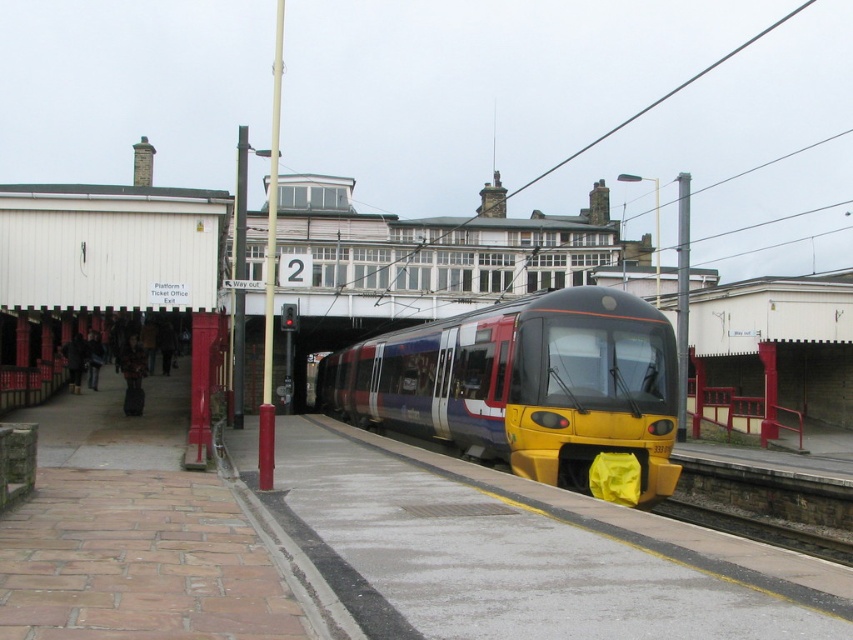
Question: Which point is farther to the camera?

Choices:
 (A) metallic blue train at center
 (B) smooth concrete train track at lower right

Answer: (A)

Question: Is metallic blue train at center above smooth concrete train track at lower right?

Choices:
 (A) no
 (B) yes

Answer: (B)

Question: In this image, where is metallic blue train at center located relative to smooth concrete train track at lower right?

Choices:
 (A) below
 (B) above

Answer: (B)

Question: Which point is farther to the camera?

Choices:
 (A) (x=590, y=323)
 (B) (x=805, y=529)

Answer: (B)

Question: Among these points, which one is nearest to the camera?

Choices:
 (A) (816, 552)
 (B) (421, 384)

Answer: (A)

Question: In this image, where is metallic blue train at center located relative to smooth concrete train track at lower right?

Choices:
 (A) below
 (B) above

Answer: (B)